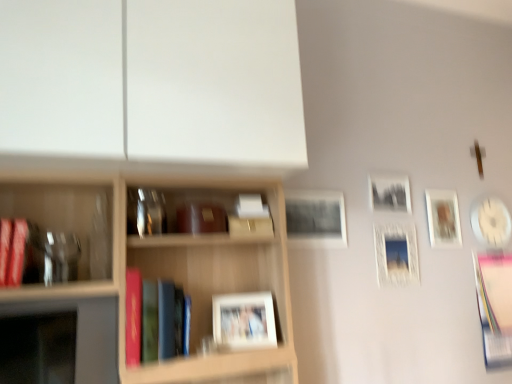
Question: Should I look upward or downward to see matte wooden picture frame at upper right, marked as the 2th picture frame in a right-to-left arrangement?

Choices:
 (A) down
 (B) up

Answer: (A)

Question: From a real-world perspective, is pink paper book at right, the third book viewed from the left, on white glossy picture frame at upper right, which is the 3th picture frame in right-to-left order?

Choices:
 (A) no
 (B) yes

Answer: (A)

Question: Considering the relative positions of pink paper book at right, marked as the first book in a back-to-front arrangement, and white glossy picture frame at upper right, which is counted as the 4th picture frame, starting from the left, in the image provided, is pink paper book at right, marked as the first book in a back-to-front arrangement, in front of white glossy picture frame at upper right, which is counted as the 4th picture frame, starting from the left,?

Choices:
 (A) yes
 (B) no

Answer: (B)

Question: Is pink paper book at right, marked as the first book in a back-to-front arrangement, smaller than white glossy picture frame at upper right, the 3th picture frame from the front?

Choices:
 (A) no
 (B) yes

Answer: (A)

Question: From the image's perspective, is pink paper book at right, the third book viewed from the left, located beneath white glossy picture frame at upper right, which is the 3th picture frame in right-to-left order?

Choices:
 (A) yes
 (B) no

Answer: (A)

Question: Does pink paper book at right, placed as the third book when sorted from front to back, contain white glossy picture frame at upper right, acting as the fourth picture frame starting from the back?

Choices:
 (A) yes
 (B) no

Answer: (B)

Question: Can you confirm if pink paper book at right, placed as the third book when sorted from front to back, is bigger than white glossy picture frame at upper right, which is counted as the 4th picture frame, starting from the left?

Choices:
 (A) yes
 (B) no

Answer: (A)

Question: From the image's perspective, is matte red book at left, the third book viewed from the back, beneath black matte picture frame at upper right, marked as the third picture frame in a back-to-front arrangement?

Choices:
 (A) no
 (B) yes

Answer: (B)

Question: Can you confirm if matte red book at left, which is the third book in right-to-left order, is smaller than black matte picture frame at upper right, which ranks as the fourth picture frame in front-to-back order?

Choices:
 (A) yes
 (B) no

Answer: (B)

Question: From a real-world perspective, is matte red book at left, marked as the first book in a front-to-back arrangement, over black matte picture frame at upper right, marked as the 4th picture frame in a right-to-left arrangement?

Choices:
 (A) no
 (B) yes

Answer: (A)

Question: Does matte red book at left, the third book viewed from the back, have a lesser width compared to black matte picture frame at upper right, marked as the 4th picture frame in a right-to-left arrangement?

Choices:
 (A) yes
 (B) no

Answer: (B)

Question: Is matte red book at left, the third book viewed from the back, next to black matte picture frame at upper right, which ranks as the fourth picture frame in front-to-back order?

Choices:
 (A) no
 (B) yes

Answer: (A)

Question: Is matte red book at left, arranged as the first book when viewed from the left, behind black matte picture frame at upper right, which ranks as the fourth picture frame in front-to-back order?

Choices:
 (A) no
 (B) yes

Answer: (A)

Question: Is matte wooden picture frame at upper right, marked as the 2th picture frame in a right-to-left arrangement, closer to the viewer compared to hardcover book at center, marked as the 2th book in a back-to-front arrangement?

Choices:
 (A) yes
 (B) no

Answer: (B)